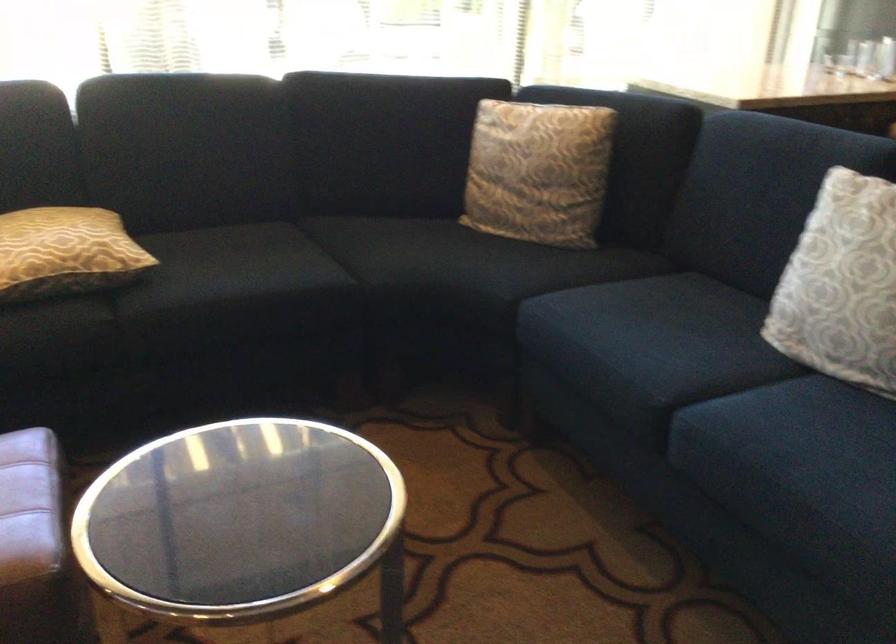
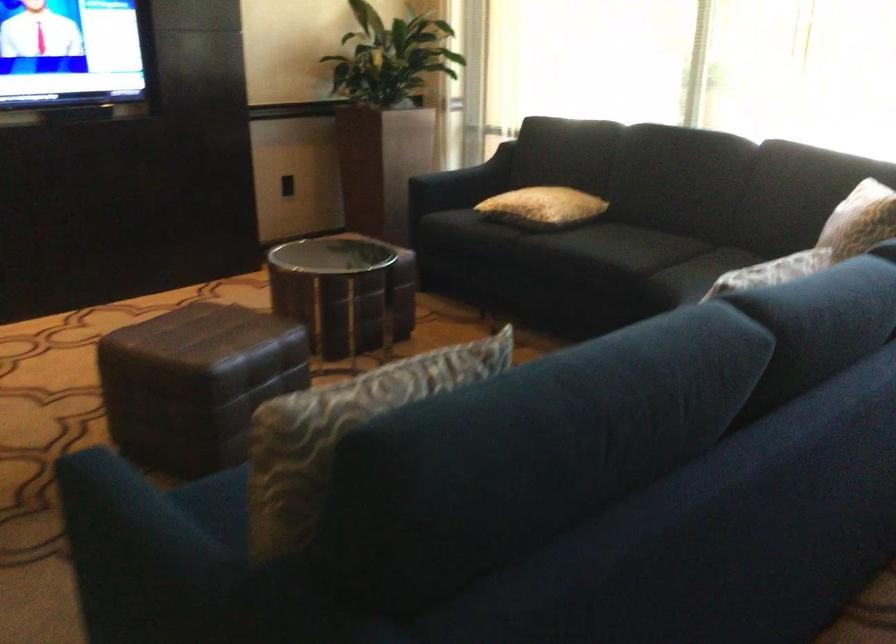
Question: I am providing you with two images of the same scene from different viewpoints. Which of the following objects are not visible in image2?

Choices:
 (A) patterned grey pillow
 (B) blue bottle
 (C) patterned cushion
 (D) brown leather ottoman

Answer: (A)